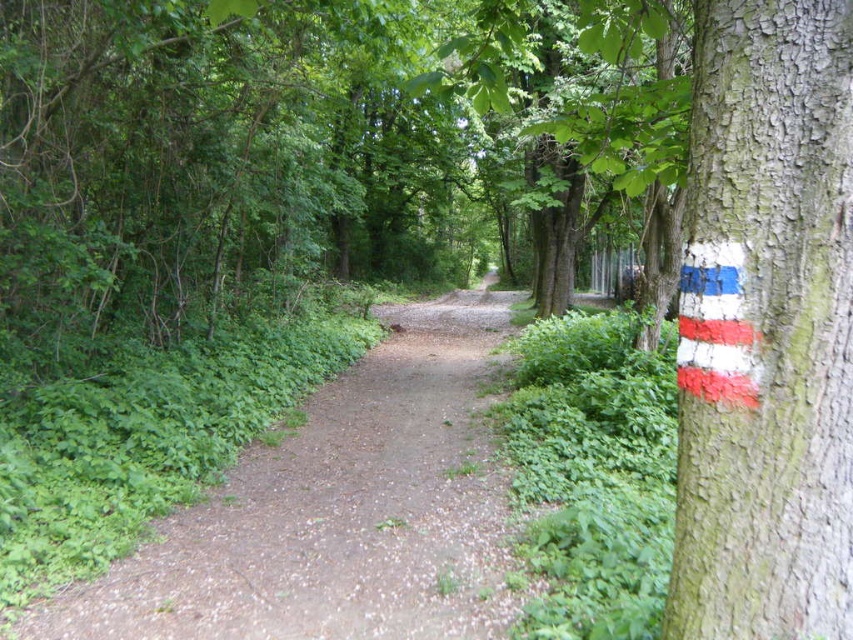
Can you confirm if smooth bark tree at right is shorter than dirt path at center?

No.

Who is positioned more to the right, smooth bark tree at right or dirt path at center?

smooth bark tree at right is more to the right.

Describe the element at coordinates (766, 328) in the screenshot. This screenshot has height=640, width=853. I see `smooth bark tree at right` at that location.

I want to click on smooth bark tree at right, so click(766, 328).